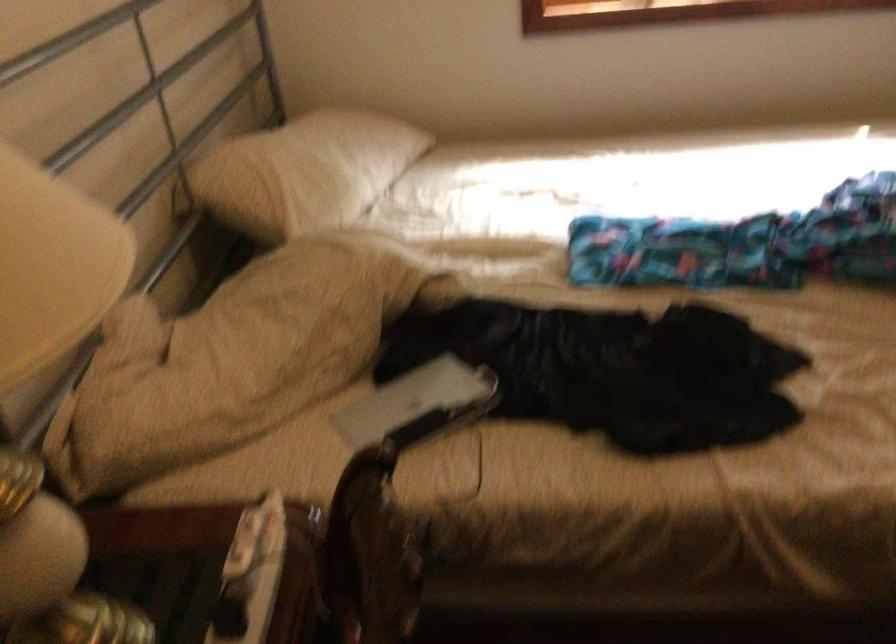
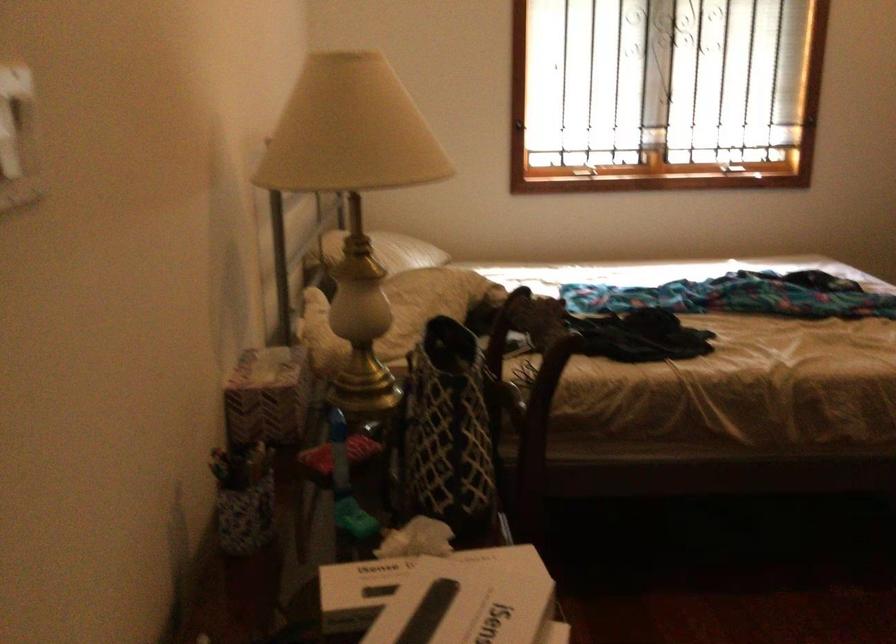
In the scene shown: In a continuous first-person perspective shot, in which direction is the camera moving?

The movement direction of the cameraman is left, backward.